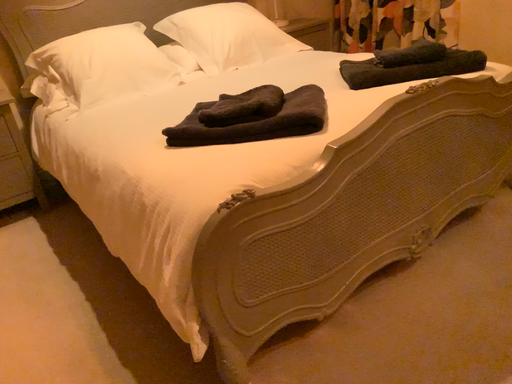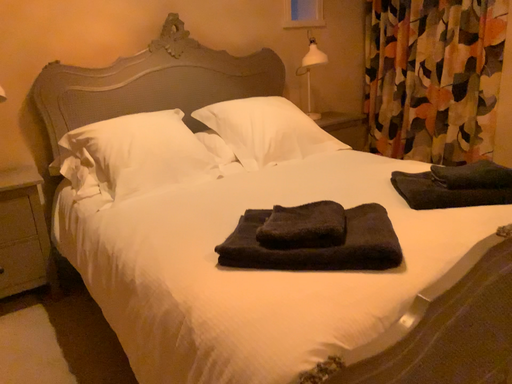
Question: How did the camera likely rotate when shooting the video?

Choices:
 (A) rotated downward
 (B) rotated upward

Answer: (B)